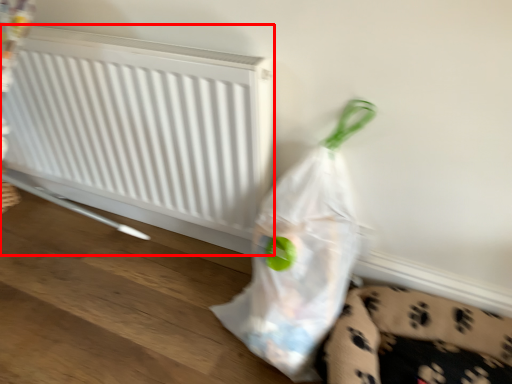
Question: From the image's perspective, where is radiator (annotated by the red box) located in relation to plastic bag in the image?

Choices:
 (A) below
 (B) above

Answer: (B)